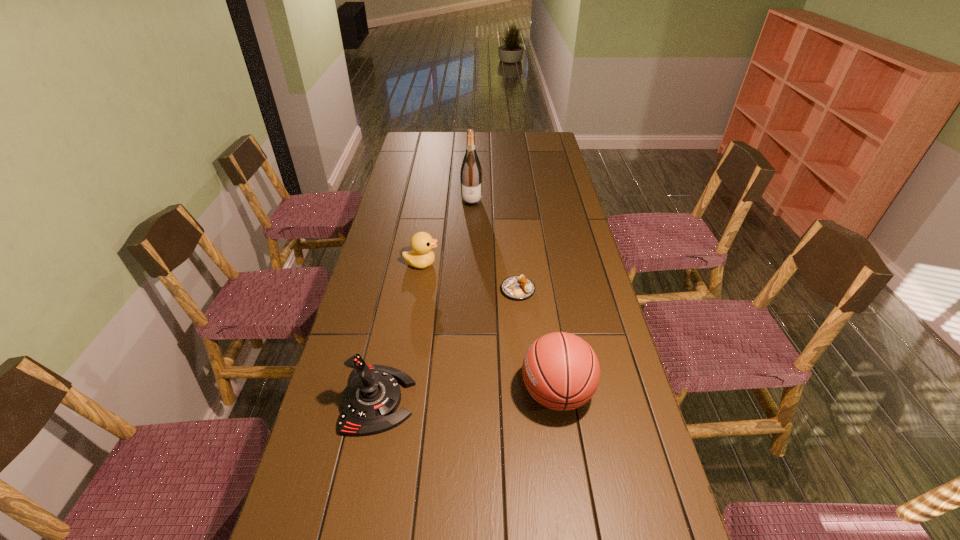
The height and width of the screenshot is (540, 960). I want to click on the third object from left to right, so click(471, 173).

Identify the location of wine bottle. Image resolution: width=960 pixels, height=540 pixels. (471, 173).

Locate an element on the screen. basketball is located at coordinates (561, 371).

You are a GUI agent. You are given a task and a screenshot of the screen. Output one action in this format:
    pyautogui.click(x=<x>, y=<y>)
    Task: Click on the joystick
    Image resolution: width=960 pixels, height=540 pixels.
    Given the screenshot: What is the action you would take?
    pyautogui.click(x=370, y=400)

I want to click on the second shortest object, so click(x=422, y=256).

The image size is (960, 540). I want to click on duck, so click(422, 256).

What are the coordinates of `pastry` in the screenshot? It's located at (516, 287).

Locate an element on the screen. Image resolution: width=960 pixels, height=540 pixels. the shortest object is located at coordinates (516, 287).

You are a GUI agent. You are given a task and a screenshot of the screen. Output one action in this format:
    pyautogui.click(x=<x>, y=<y>)
    Task: Click on the vacant space located on the label of the third object from right to left
    
    Given the screenshot: What is the action you would take?
    click(470, 239)

Image resolution: width=960 pixels, height=540 pixels. What are the coordinates of `vacant region located 0.180m on the logo side of the basketball` in the screenshot? It's located at (456, 393).